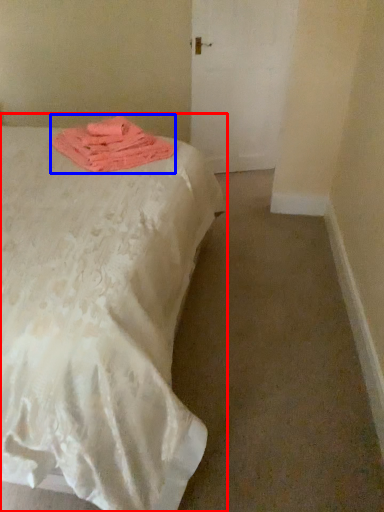
Question: Which point is further to the camera, bed (highlighted by a red box) or cloth (highlighted by a blue box)?

Choices:
 (A) bed
 (B) cloth

Answer: (B)